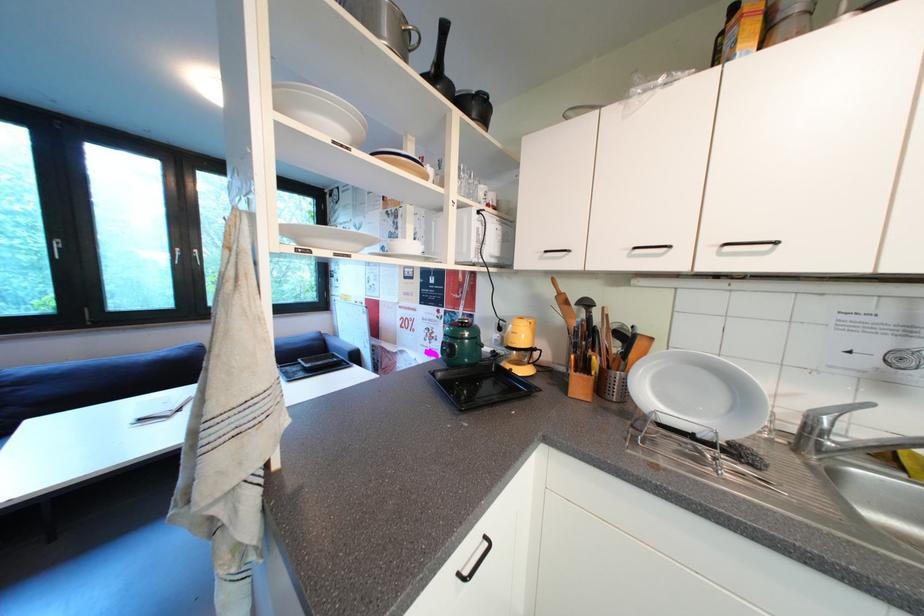
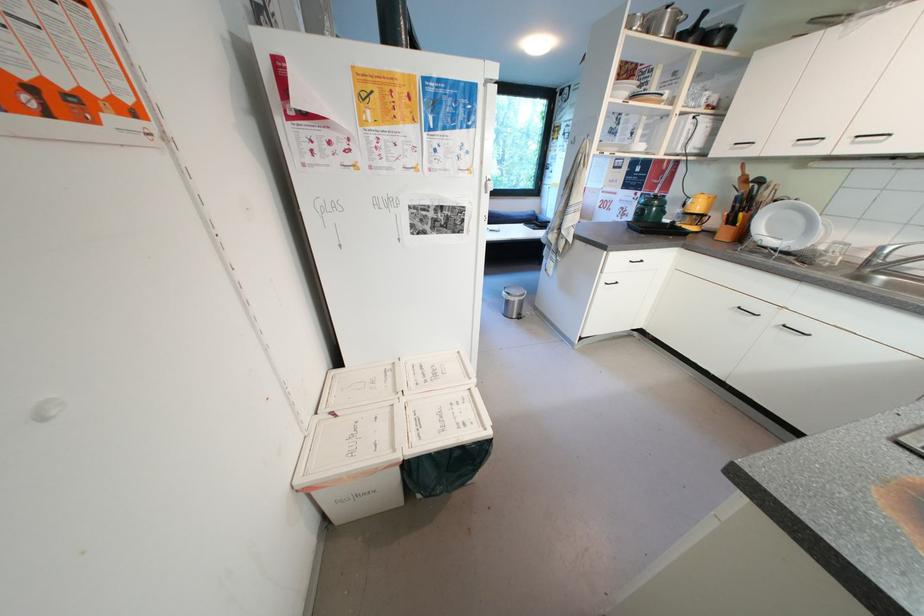
Where in the second image is the point corresponding to point (821, 431) from the first image?

(883, 257)